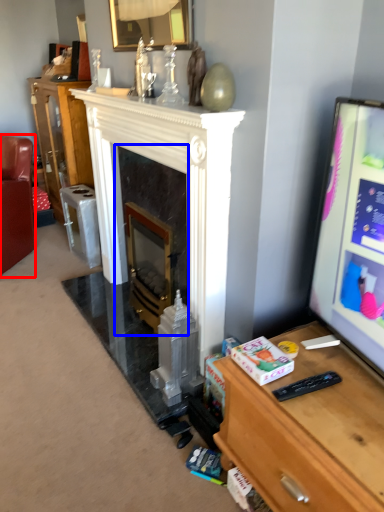
Question: Which point is closer to the camera, furniture (highlighted by a red box) or fireplace (highlighted by a blue box)?

Choices:
 (A) furniture
 (B) fireplace

Answer: (B)